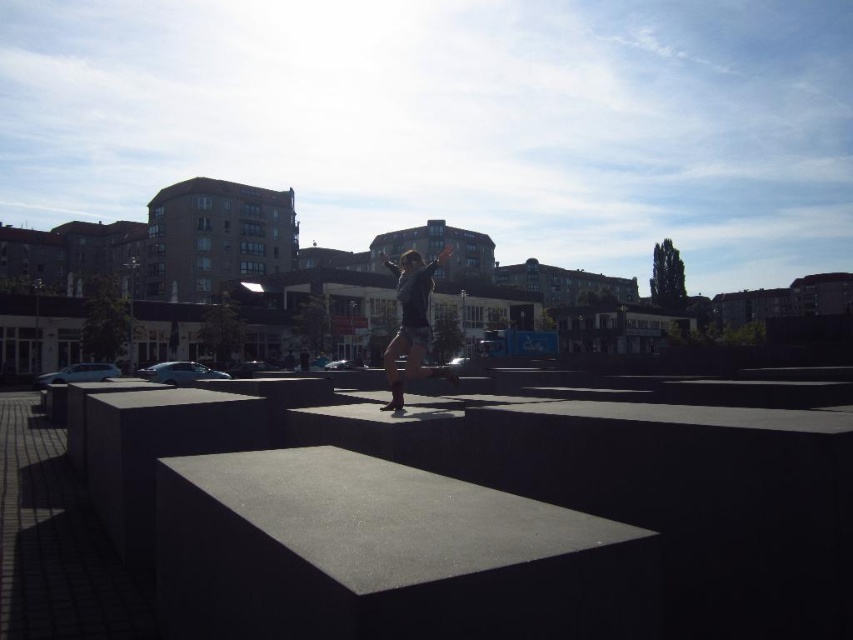
Between smooth concrete ledge at center and matte black skateboarder at center, which one has more height?

matte black skateboarder at center

Is smooth concrete ledge at center positioned behind matte black skateboarder at center?

That is False.

Where is `smooth concrete ledge at center`? smooth concrete ledge at center is located at coordinates (479, 508).